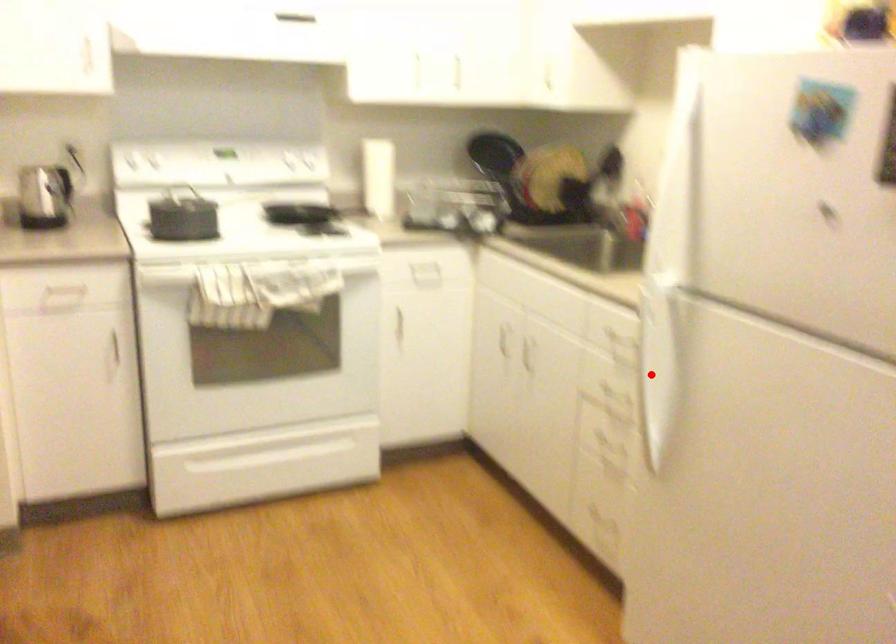
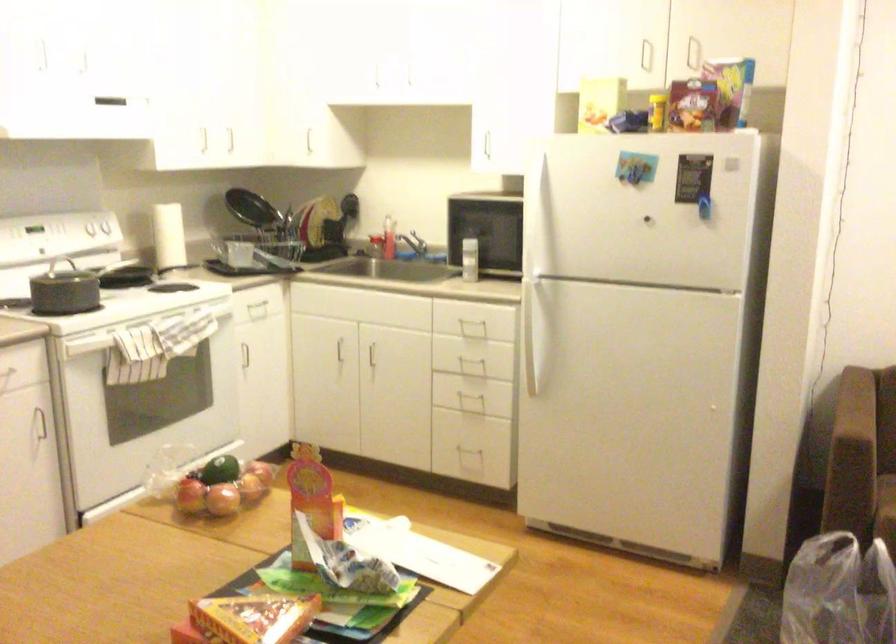
Question: I am providing you with two images of the same scene from different viewpoints. In image1, a red point is highlighted. Considering the same 3D point in image2, which of the following is correct?

Choices:
 (A) It is closer
 (B) It is farther

Answer: (B)